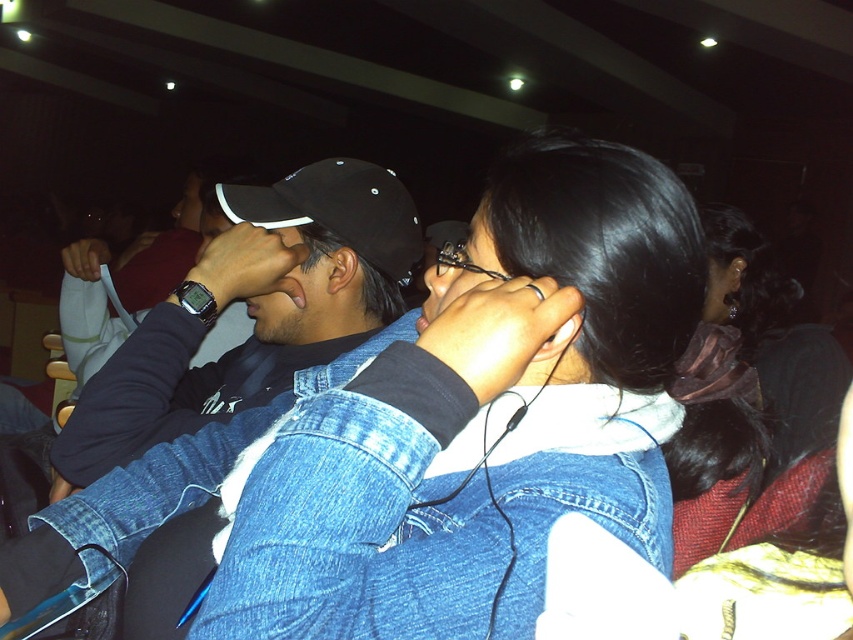
Question: Can you confirm if denim jacket at center is positioned to the right of black satin hair at center?

Choices:
 (A) no
 (B) yes

Answer: (A)

Question: Does black matte cap at upper left have a smaller size compared to black matte baseball cap at center?

Choices:
 (A) yes
 (B) no

Answer: (B)

Question: Which is farther from the denim jacket at center?

Choices:
 (A) black matte baseball cap at center
 (B) black satin hair at center
 (C) faded denim jacket at lower right
 (D) black matte cap at upper left

Answer: (A)

Question: Does black matte cap at upper left have a smaller size compared to black matte baseball cap at center?

Choices:
 (A) yes
 (B) no

Answer: (B)

Question: Which object is the closest to the black satin hair at center?

Choices:
 (A) black matte cap at upper left
 (B) black matte baseball cap at center

Answer: (B)

Question: Considering the real-world distances, which object is closest to the denim jacket at center?

Choices:
 (A) faded denim jacket at lower right
 (B) black satin hair at center
 (C) black matte cap at upper left

Answer: (A)